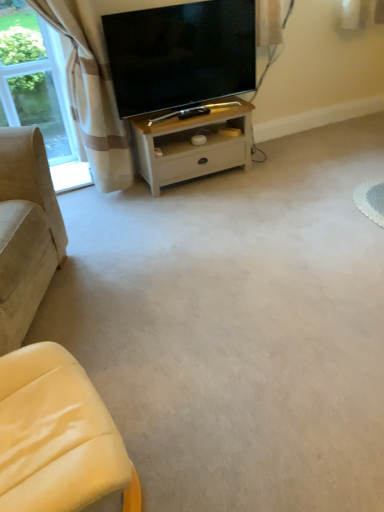
The width and height of the screenshot is (384, 512). Find the location of `unoccupied space behind yellow leather studio couch at lower left, which is the 1th studio couch from right to left`. unoccupied space behind yellow leather studio couch at lower left, which is the 1th studio couch from right to left is located at coordinates (135, 380).